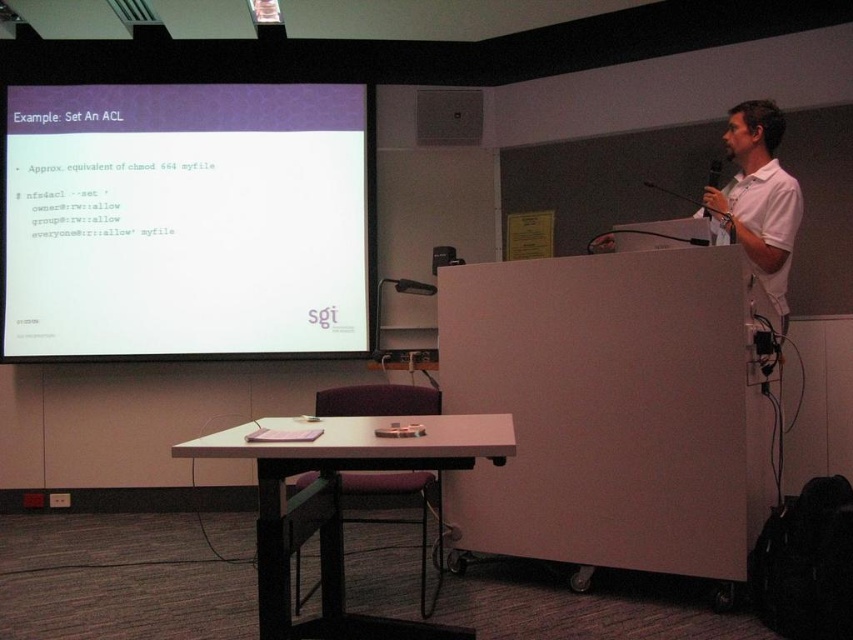
You are an attendee in the conference room. You want to move from your seat to the podium to ask a question. The podium is located at point (339, 506). However, there is a black bag on the floor next to the podium. Can you step over the black bag to reach the podium?

The podium at center is located at point (339, 506). Since the black bag is placed on the floor next to the podium, you can step over the black bag to reach the podium.

You are an attendee sitting in the front row of the conference room. You want to see the presenter clearly. Which object is closer to you between the white matte projector screen at upper left and the white cotton shirt at upper right?

The white matte projector screen at upper left is closer to you because the white cotton shirt at upper right is behind it.

You are an event organizer setting up for a presentation. You have a white plastic podium at center and a white matte projector screen at upper left. Which object has a greater width?

The white matte projector screen at upper left has a greater width than the white plastic podium at center.